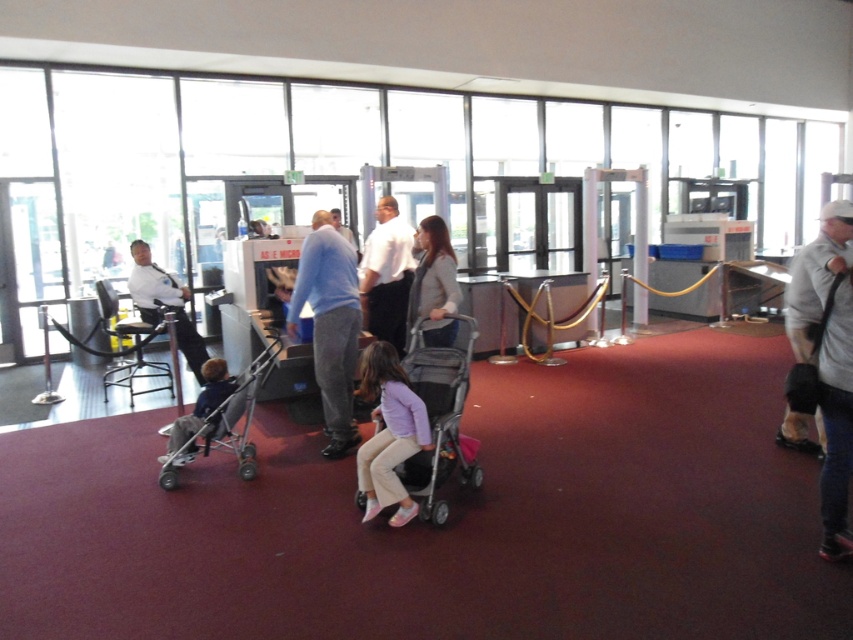
Does point (392, 209) come behind point (177, 289)?

No.

Which of these two, white shirt at center or matte black uniform at center, stands taller?

With more height is matte black uniform at center.

Is point (369, 310) closer to camera compared to point (172, 294)?

Yes, point (369, 310) is closer to viewer.

The height and width of the screenshot is (640, 853). I want to click on white shirt at center, so [x=387, y=275].

Measure the distance between pink fabric stroller at center and silver metallic stroller at left.

A distance of 38.79 inches exists between pink fabric stroller at center and silver metallic stroller at left.

Is pink fabric stroller at center below silver metallic stroller at left?

Incorrect, pink fabric stroller at center is not positioned below silver metallic stroller at left.

Is point (436, 435) in front of point (248, 413)?

That is True.

Where is `pink fabric stroller at center`? The width and height of the screenshot is (853, 640). pink fabric stroller at center is located at coordinates (440, 419).

Is light blue sweater at center positioned behind silver metallic stroller at left?

Yes, it is behind silver metallic stroller at left.

Does light blue sweater at center have a lesser width compared to silver metallic stroller at left?

Yes, light blue sweater at center is thinner than silver metallic stroller at left.

Where is `light blue sweater at center`? The height and width of the screenshot is (640, 853). light blue sweater at center is located at coordinates (329, 324).

This screenshot has height=640, width=853. I want to click on light blue sweater at center, so click(x=329, y=324).